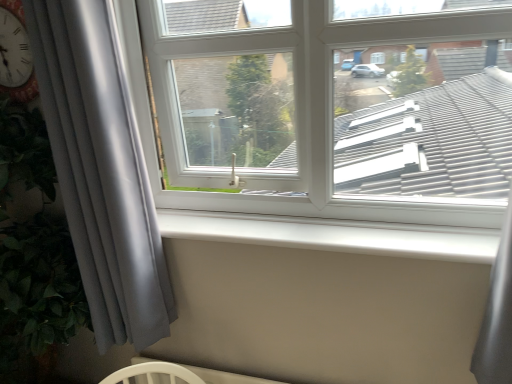
I want to click on free space above white smooth window sill at center (from a real-world perspective), so click(x=343, y=218).